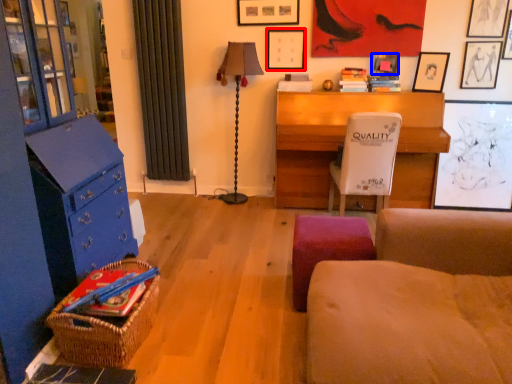
Question: Among these objects, which one is farthest to the camera, picture frame (highlighted by a red box) or picture frame (highlighted by a blue box)?

Choices:
 (A) picture frame
 (B) picture frame

Answer: (A)